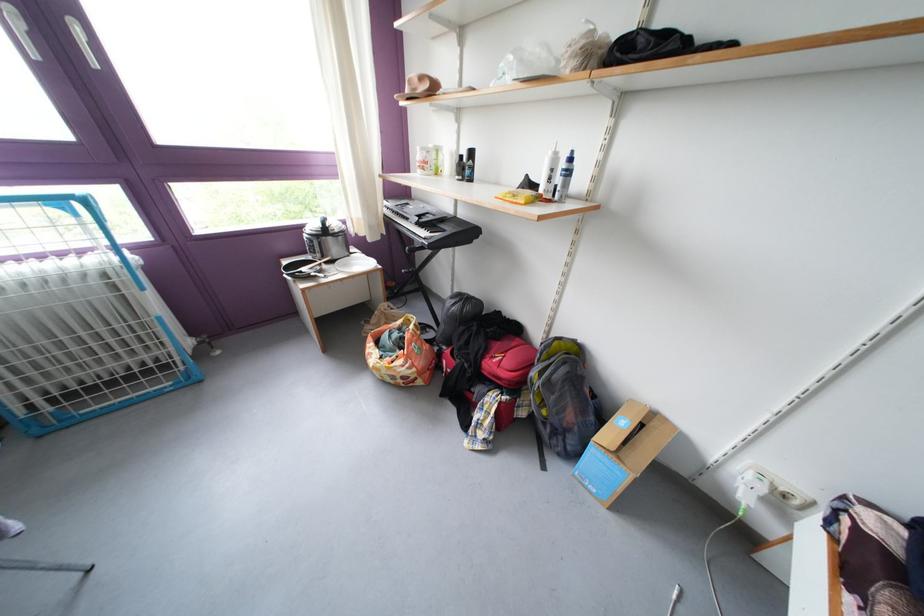
Where would you lift the red backpack? Please return your answer as a coordinate pair (x, y).

(484, 365)